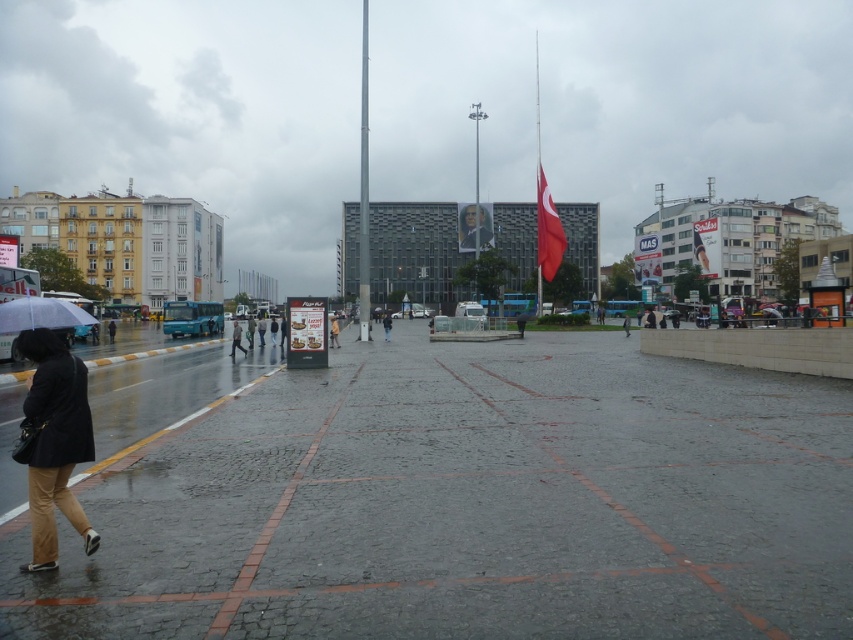
Does gray cobblestone pavement at center have a smaller size compared to red fabric flag at center?

Yes, gray cobblestone pavement at center is smaller than red fabric flag at center.

Is gray cobblestone pavement at center bigger than red fabric flag at center?

Actually, gray cobblestone pavement at center might be smaller than red fabric flag at center.

Locate an element on the screen. This screenshot has width=853, height=640. gray cobblestone pavement at center is located at coordinates [471, 502].

Image resolution: width=853 pixels, height=640 pixels. Describe the element at coordinates (334, 332) in the screenshot. I see `yellow fabric jacket at center` at that location.

Is yellow fabric jacket at center further to the viewer compared to black matte jacket at lower left?

No, it is in front of black matte jacket at lower left.

This screenshot has height=640, width=853. I want to click on yellow fabric jacket at center, so click(334, 332).

Identify the location of yellow fabric jacket at center. The height and width of the screenshot is (640, 853). (334, 332).

From the picture: Is matte black coat at lower left further to camera compared to black matte jacket at lower left?

No, it is in front of black matte jacket at lower left.

Who is lower down, matte black coat at lower left or black matte jacket at lower left?

Positioned lower is black matte jacket at lower left.

Does point (82, 368) come closer to viewer compared to point (109, 333)?

Yes, point (82, 368) is closer to viewer.

Where is `matte black coat at lower left`? The height and width of the screenshot is (640, 853). matte black coat at lower left is located at coordinates (54, 442).